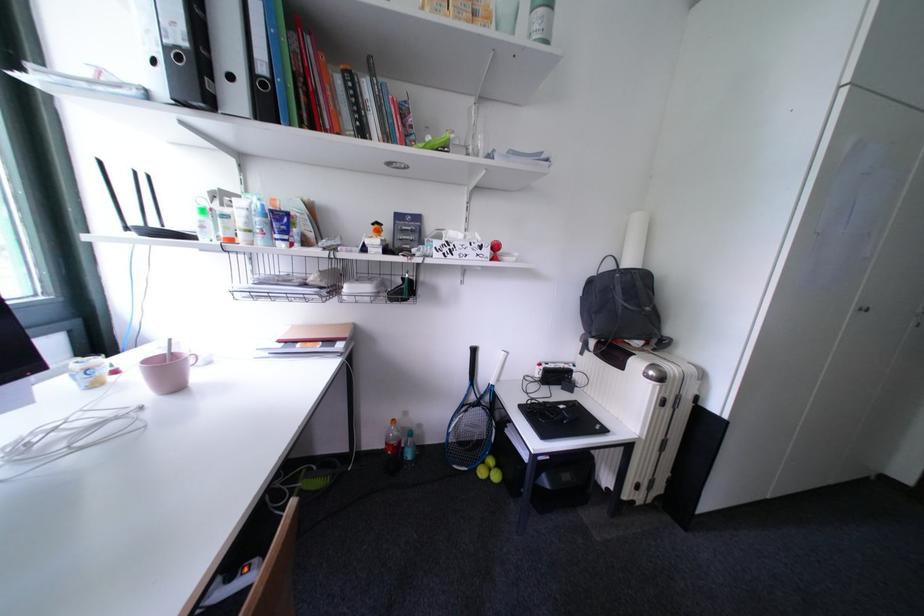
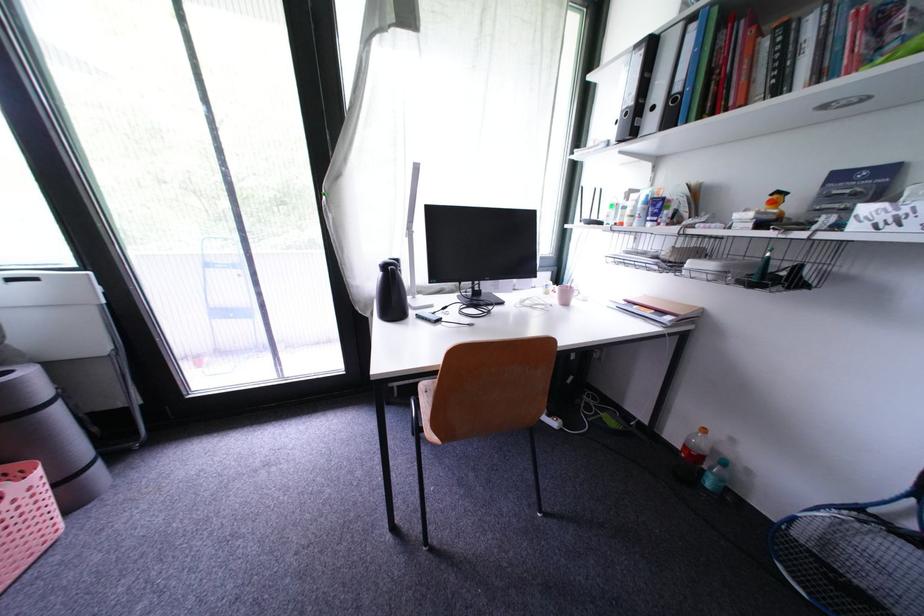
Where in the second image is the point corresponding to [394,446] from the first image?

(694, 448)